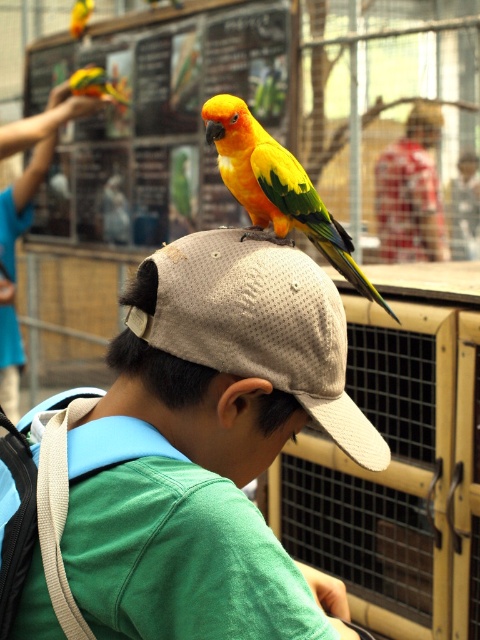
Question: Is beige mesh baseball cap at center positioned behind yellow-green parrot at center?

Choices:
 (A) yes
 (B) no

Answer: (B)

Question: Is beige mesh baseball cap at center behind yellow-green parrot at center?

Choices:
 (A) yes
 (B) no

Answer: (B)

Question: Is beige mesh baseball cap at center positioned at the back of yellow-green parrot at center?

Choices:
 (A) no
 (B) yes

Answer: (A)

Question: Which is farther from the beige mesh baseball cap at center?

Choices:
 (A) matte khaki cap at center
 (B) yellow-green parrot at center

Answer: (B)

Question: Estimate the real-world distances between objects in this image. Which object is farther from the yellow-green parrot at center?

Choices:
 (A) matte khaki cap at center
 (B) beige mesh baseball cap at center

Answer: (A)

Question: Estimate the real-world distances between objects in this image. Which object is farther from the yellow-green parrot at center?

Choices:
 (A) matte khaki cap at center
 (B) beige mesh baseball cap at center

Answer: (A)